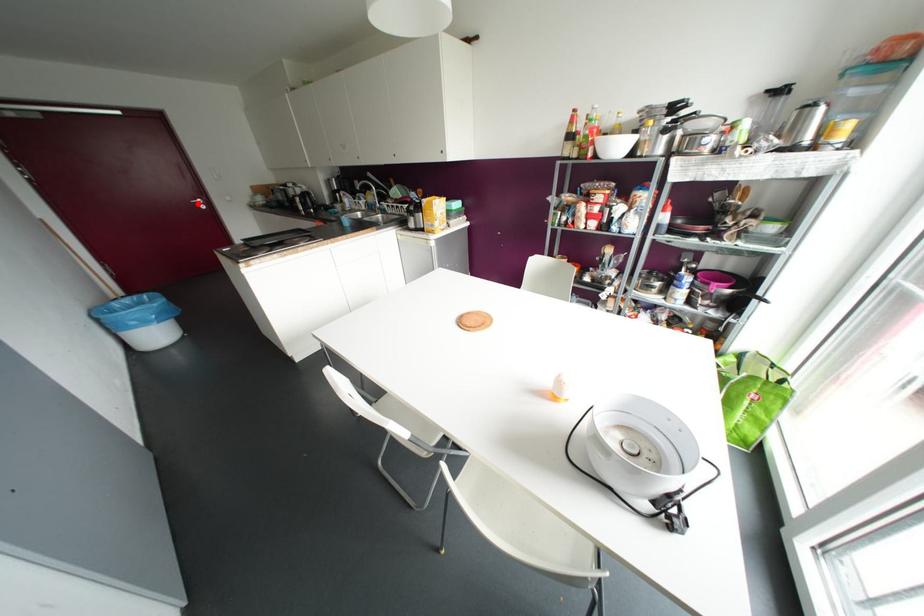
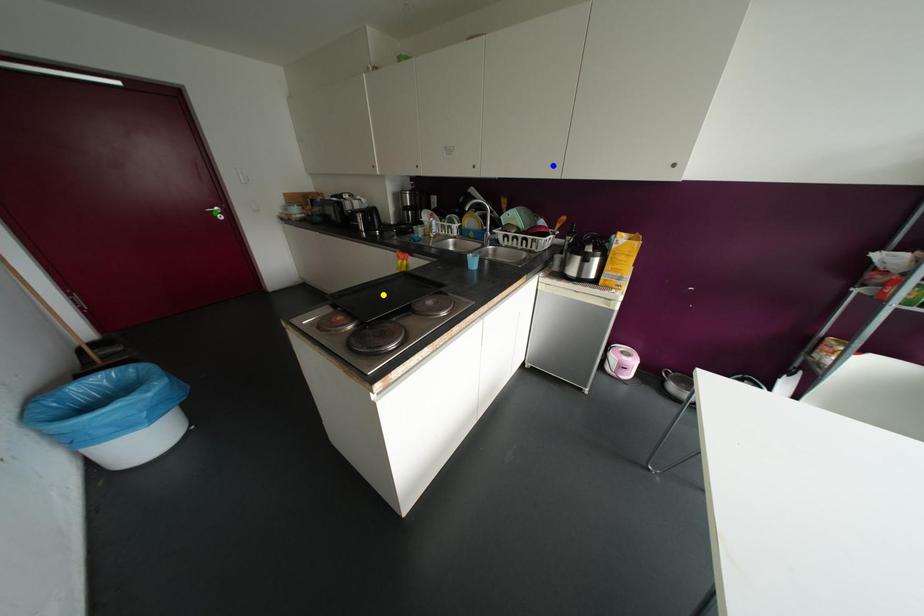
Question: I am providing you with two images of the same scene from different viewpoints. A red point is marked on the first image. You are given multiple points on the second image. Can you choose the point in image 2 that corresponds to the point in image 1?

Choices:
 (A) green point
 (B) blue point
 (C) yellow point

Answer: (A)